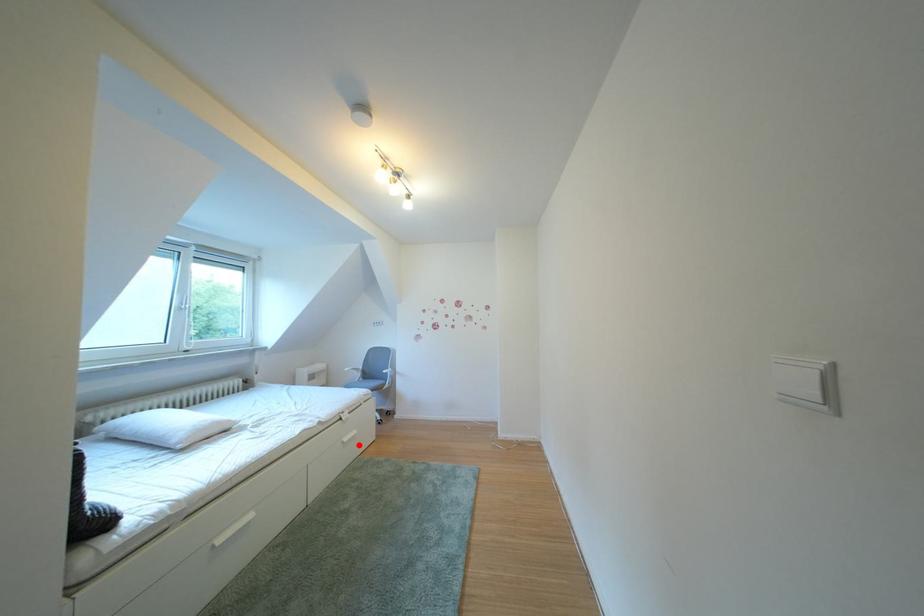
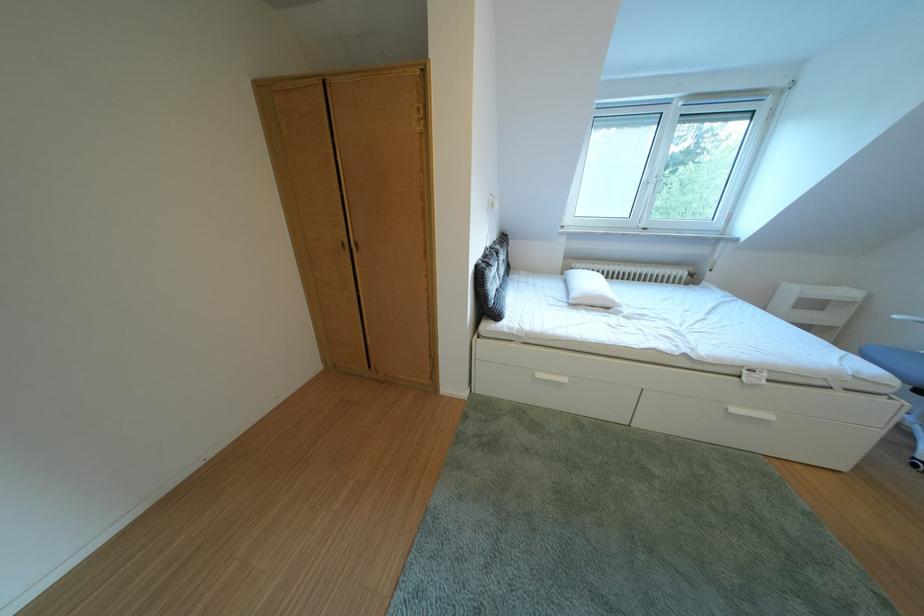
Locate, in the second image, the point that corresponds to the highlighted location in the first image.

(748, 415)